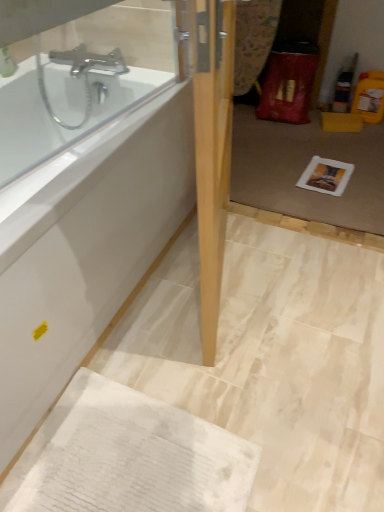
Find the location of a particular element. The height and width of the screenshot is (512, 384). vacant space to the left of light wood door at center is located at coordinates (162, 295).